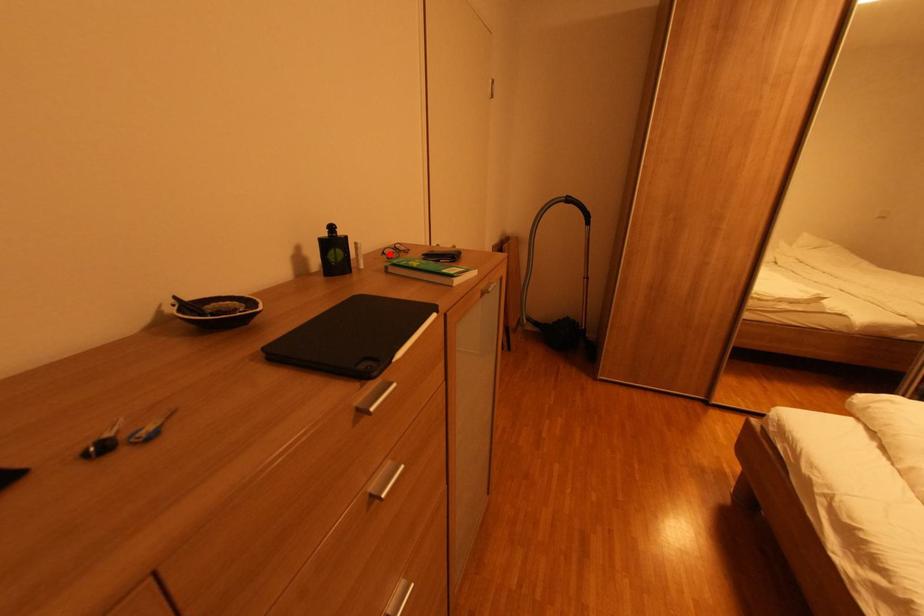
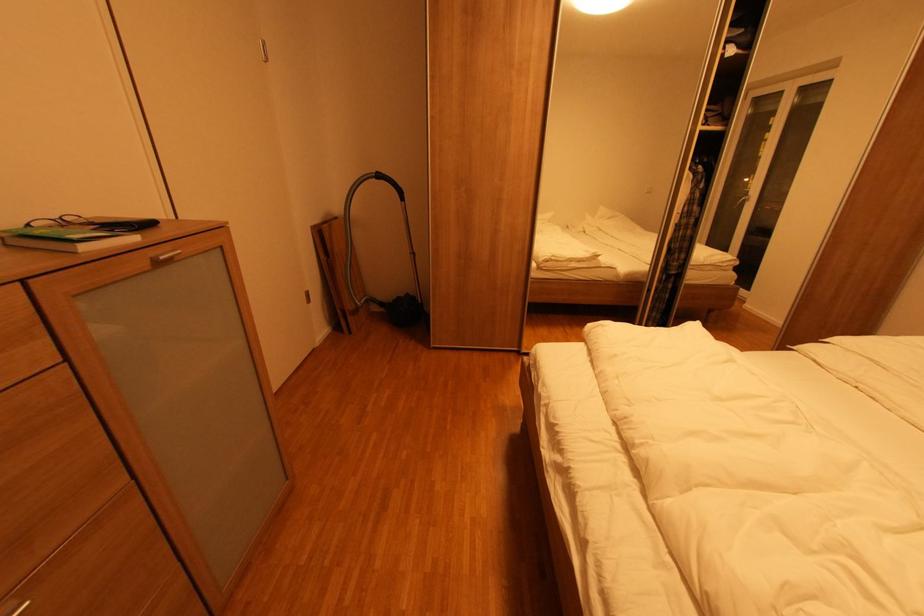
Locate, in the second image, the point that corresponds to the highlighted location in the first image.

(35, 225)